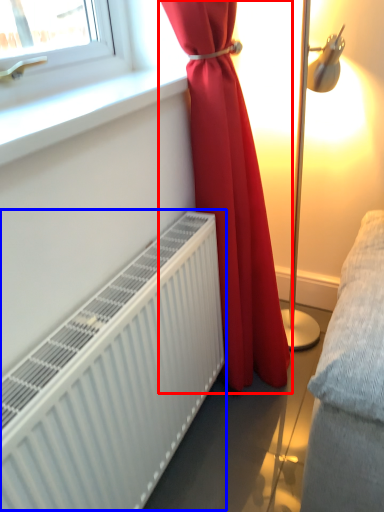
Question: Which of the following is the closest to the observer, curtain (highlighted by a red box) or radiator (highlighted by a blue box)?

Choices:
 (A) curtain
 (B) radiator

Answer: (B)